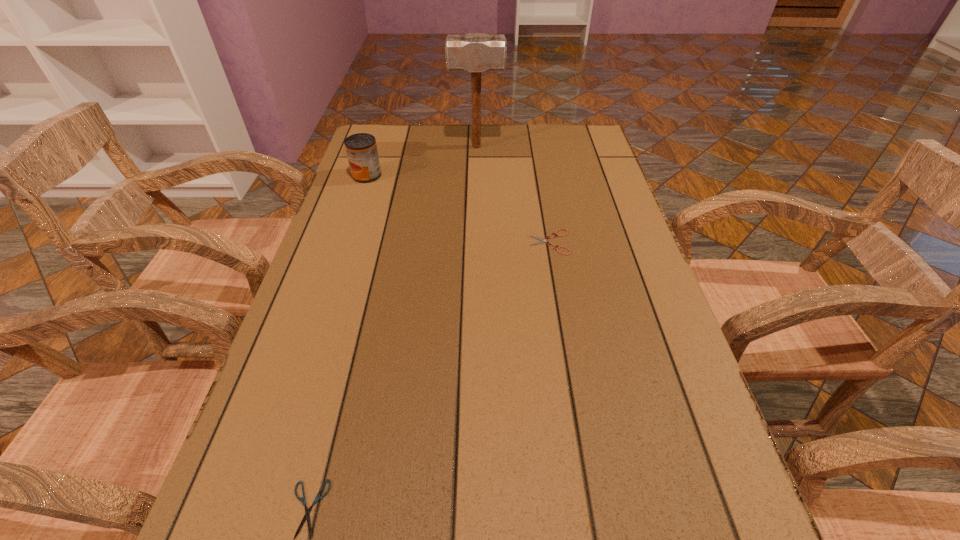
This screenshot has width=960, height=540. In order to click on empty space between the third shortest object and the farther shears in this screenshot , I will do `click(458, 208)`.

Locate an element on the screen. This screenshot has width=960, height=540. free point between the farther shears and the leftmost object is located at coordinates (458, 208).

Locate an element on the screen. This screenshot has width=960, height=540. vacant space that's between the second tallest object and the third farthest object is located at coordinates (458, 208).

Where is `the second closest object to the can`? The width and height of the screenshot is (960, 540). the second closest object to the can is located at coordinates (543, 240).

The height and width of the screenshot is (540, 960). What are the coordinates of `object that stands as the closest to the third shortest object` in the screenshot? It's located at (476, 52).

This screenshot has height=540, width=960. I want to click on vacant area that satisfies the following two spatial constraints: 1. on the striking face of the right shears; 2. on the left side of the mallet, so click(475, 242).

Find the location of `free point that satisfies the following two spatial constraints: 1. on the striking face of the tallest object; 2. on the front side of the leftmost object`. free point that satisfies the following two spatial constraints: 1. on the striking face of the tallest object; 2. on the front side of the leftmost object is located at coordinates (476, 176).

Locate an element on the screen. free space that satisfies the following two spatial constraints: 1. on the striking face of the third farthest object; 2. on the left side of the second object from right to left is located at coordinates (475, 242).

This screenshot has width=960, height=540. In order to click on vacant space that satisfies the following two spatial constraints: 1. on the striking face of the tallest object; 2. on the back side of the farther shears in this screenshot , I will do `click(475, 242)`.